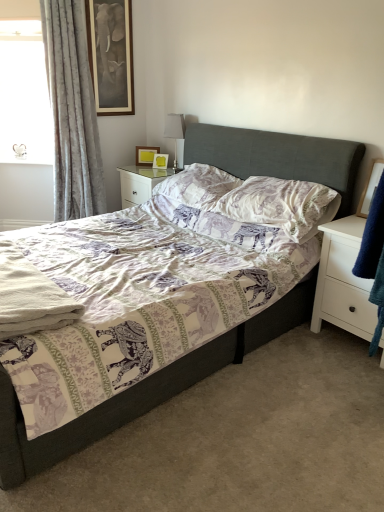
Question: From a real-world perspective, is printed fabric pillow at center, acting as the 2th pillow starting from the back, above or below satin silver table lamp at upper center?

Choices:
 (A) below
 (B) above

Answer: (A)

Question: In terms of size, does printed fabric pillow at center, which is counted as the 1th pillow, starting from the front, appear bigger or smaller than satin silver table lamp at upper center?

Choices:
 (A) small
 (B) big

Answer: (B)

Question: Which of these objects is positioned closest to the printed fabric pillow at center, acting as the 2th pillow starting from the back?

Choices:
 (A) white glossy nightstand at center, which is the first nightstand from left to right
 (B) satin silver table lamp at upper center
 (C) silky gray curtain at left
 (D) wooden picture frame at right, the 1th picture frame from the bottom
 (E) matte yellow picture frame at upper center, which is the second picture frame from front to back

Answer: (D)

Question: Estimate the real-world distances between objects in this image. Which object is closer to the white glossy nightstand at center, the first nightstand from the top?

Choices:
 (A) matte yellow picture frame at upper center, which ranks as the 2th picture frame in bottom-to-top order
 (B) textured gray bed at center
 (C) white matte nightstand at lower right, the 1th nightstand in the bottom-to-top sequence
 (D) silky gray curtain at left
 (E) printed fabric pillow at center, which is counted as the 1th pillow, starting from the front

Answer: (A)